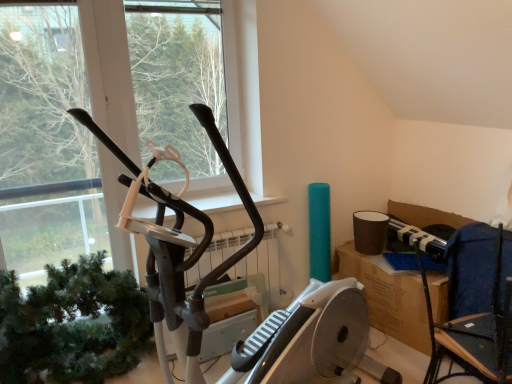
Question: In terms of width, does dark blue fabric chair at right look wider or thinner when compared to black matte elliptical machine at center?

Choices:
 (A) thin
 (B) wide

Answer: (B)

Question: In terms of height, does dark blue fabric chair at right look taller or shorter compared to black matte elliptical machine at center?

Choices:
 (A) tall
 (B) short

Answer: (B)

Question: Which of these objects is positioned closest to the black matte elliptical machine at center?

Choices:
 (A) black matte stationary bicycle at left
 (B) green matte plant at left
 (C) dark blue fabric chair at right

Answer: (B)

Question: Estimate the real-world distances between objects in this image. Which object is farther from the dark blue fabric chair at right?

Choices:
 (A) black matte elliptical machine at center
 (B) black matte stationary bicycle at left
 (C) green matte plant at left

Answer: (A)